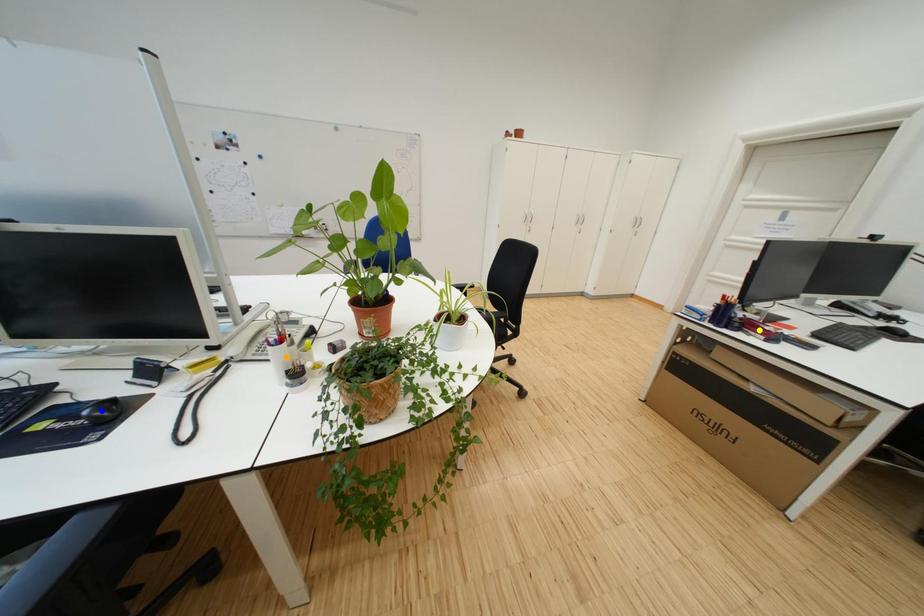
Order these from nearest to farthest:
blue point | orange point | yellow point

yellow point < orange point < blue point